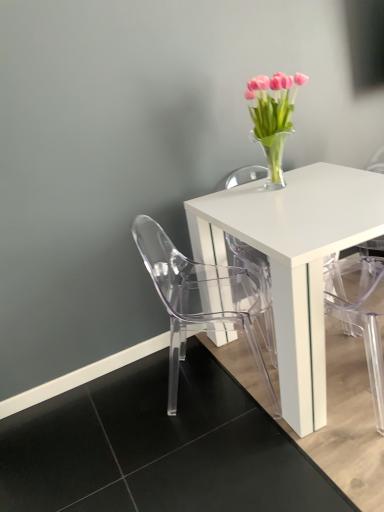
Question: Visually, is transparent plastic chair at lower left positioned to the left or to the right of transparent plastic armchair at lower right?

Choices:
 (A) right
 (B) left

Answer: (B)

Question: From a real-world perspective, is transparent plastic chair at lower left physically located above or below transparent plastic armchair at lower right?

Choices:
 (A) above
 (B) below

Answer: (B)

Question: Which is nearer to the white glossy table at center?

Choices:
 (A) transparent plastic chair at lower left
 (B) pink glass vase at upper right
 (C) transparent plastic armchair at lower right

Answer: (A)

Question: Which object is positioned farthest from the pink glass vase at upper right?

Choices:
 (A) white glossy table at center
 (B) transparent plastic chair at lower left
 (C) transparent plastic armchair at lower right

Answer: (C)